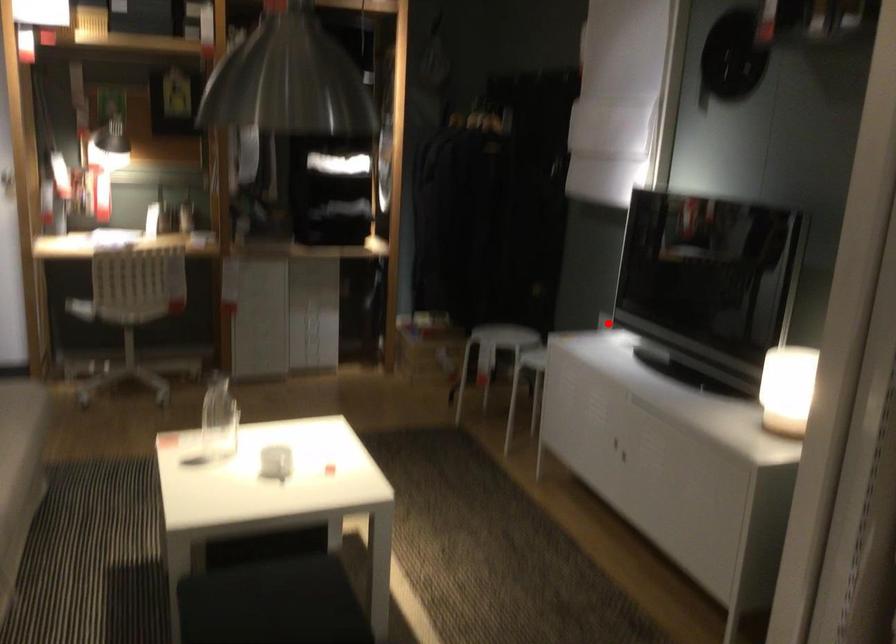
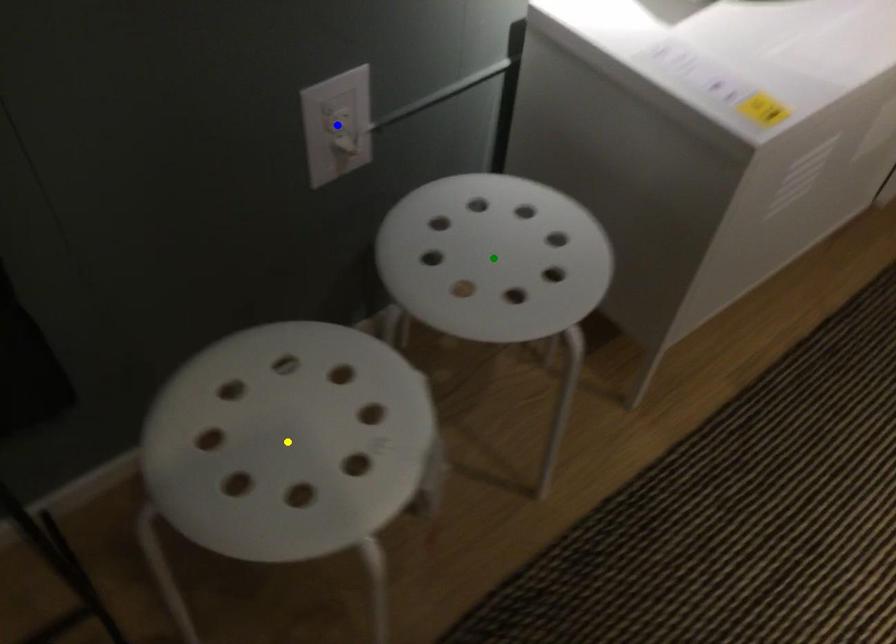
Question: I am providing you with two images of the same scene from different viewpoints. A red point is marked on the first image. You are given multiple points on the second image. In image 2, which mark is for the same physical point as the one in image 1?

Choices:
 (A) yellow point
 (B) green point
 (C) blue point

Answer: (C)